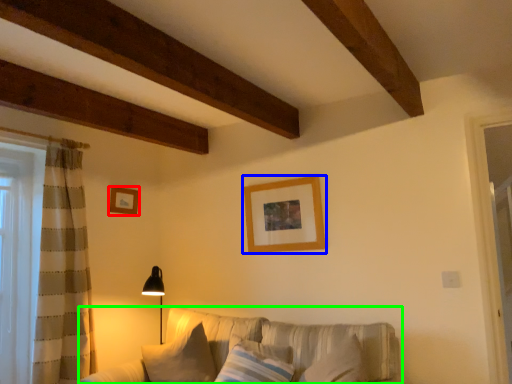
Question: Which object is the closest to the picture frame (highlighted by a red box)? Choose among these: picture frame (highlighted by a blue box) or studio couch (highlighted by a green box).

Choices:
 (A) picture frame
 (B) studio couch

Answer: (A)